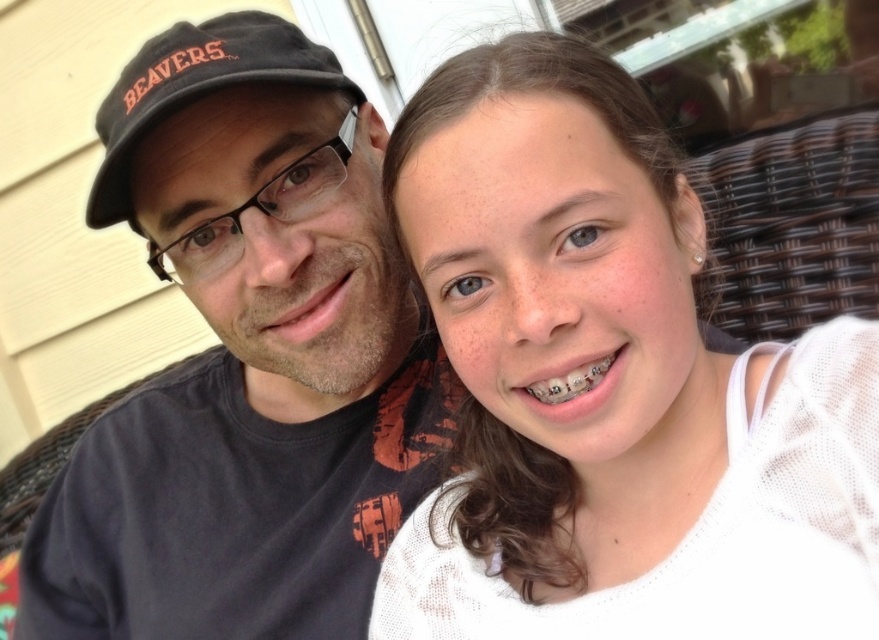
Is point (338, 470) farther from camera compared to point (107, 92)?

No, (338, 470) is in front of (107, 92).

What do you see at coordinates (247, 358) in the screenshot? This screenshot has height=640, width=879. I see `dark gray t-shirt at left` at bounding box center [247, 358].

You are a GUI agent. You are given a task and a screenshot of the screen. Output one action in this format:
    pyautogui.click(x=<x>, y=<y>)
    Task: Click on the dark gray t-shirt at left
    This screenshot has width=879, height=640.
    Given the screenshot: What is the action you would take?
    pyautogui.click(x=247, y=358)

Measure the distance between point (783, 554) and camera.

Point (783, 554) and camera are 20.06 inches apart from each other.

Is point (532, 148) in front of point (155, 104)?

Yes, it is.

Is point (436, 314) farther from camera compared to point (208, 88)?

No, (436, 314) is in front of (208, 88).

Find the location of a particular element. white knit sweater at upper right is located at coordinates 611,387.

Consider the image. Can you confirm if white knit sweater at upper right is thinner than dark gray t-shirt at left?

Indeed, white knit sweater at upper right has a lesser width compared to dark gray t-shirt at left.

How much distance is there between white knit sweater at upper right and dark gray t-shirt at left?

10.15 inches

Between point (427, 568) and point (329, 147), which one is positioned behind?

Point (329, 147)

Image resolution: width=879 pixels, height=640 pixels. Find the location of `white knit sweater at upper right`. white knit sweater at upper right is located at coordinates click(611, 387).